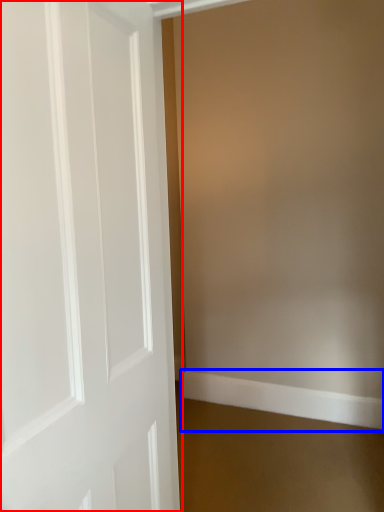
Question: Which point is closer to the camera, door (highlighted by a red box) or molding (highlighted by a blue box)?

Choices:
 (A) door
 (B) molding

Answer: (A)